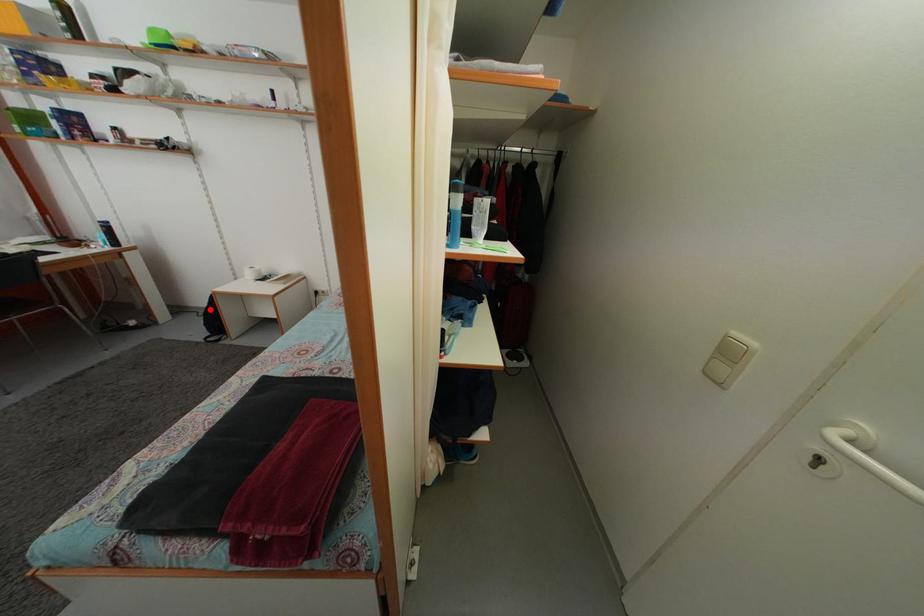
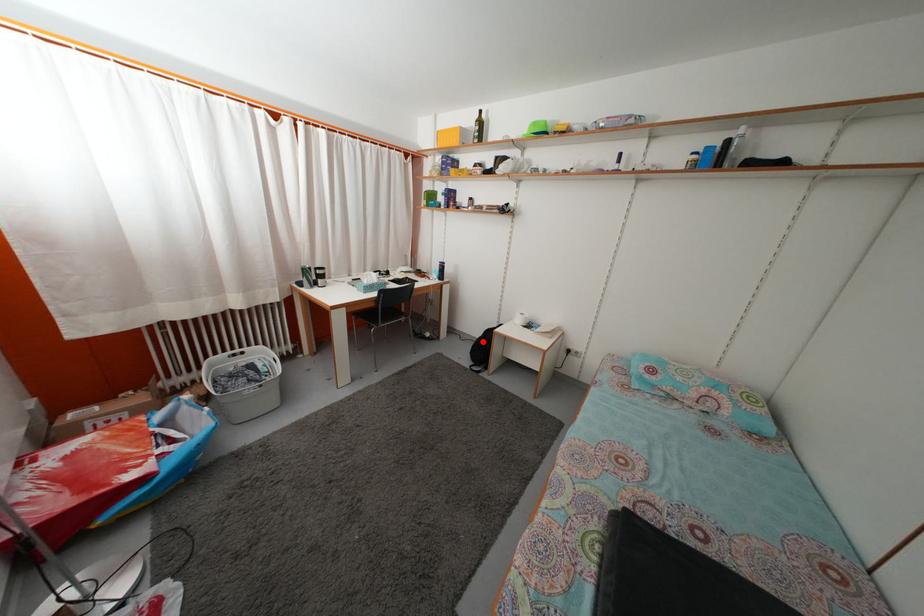
I am providing you with two images of the same scene from different viewpoints. A red point is marked on the first image and another point is marked on the second image. Is the marked point in image1 the same physical position as the marked point in image2?

Yes